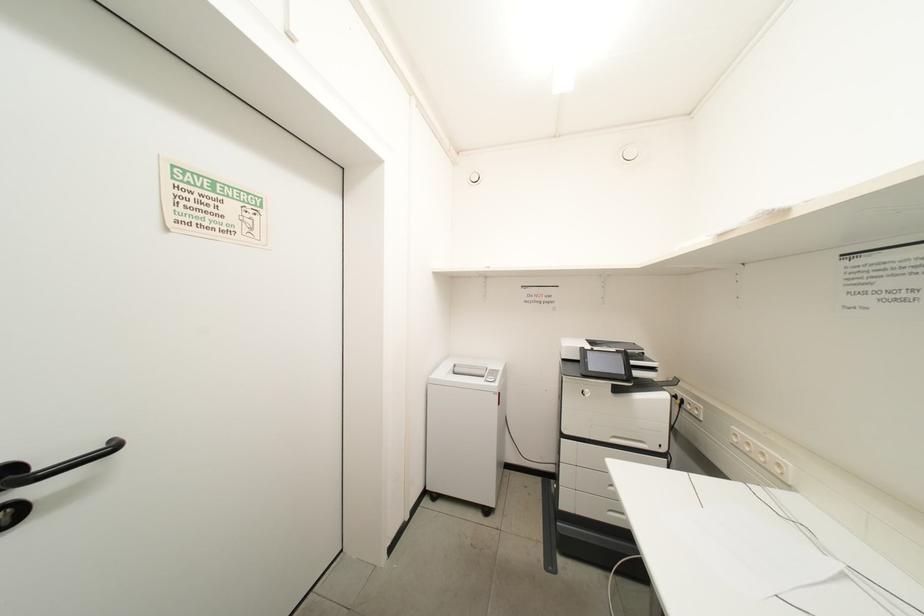
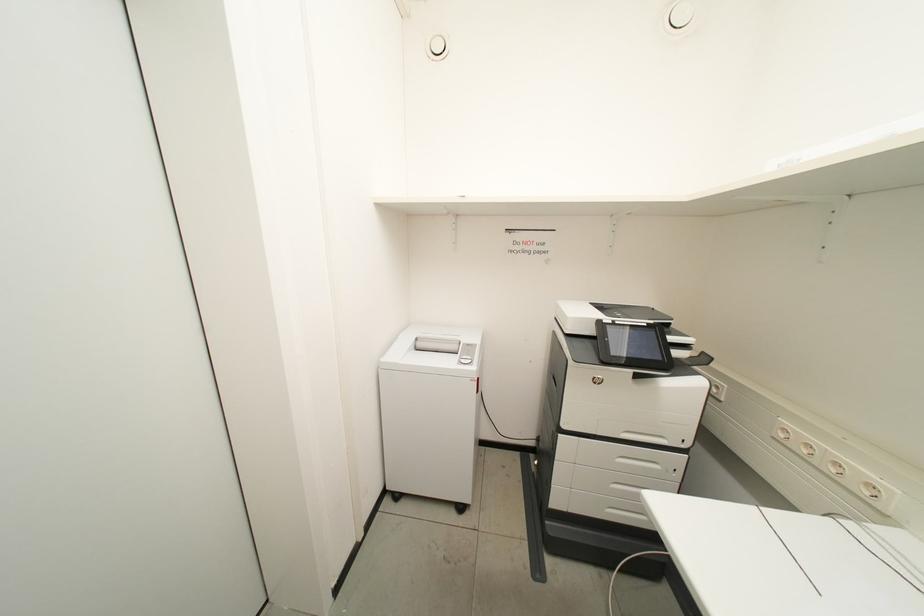
Question: In a continuous first-person perspective shot, in which direction is the camera moving?

Choices:
 (A) Left
 (B) Right
 (C) Forward
 (D) Backward

Answer: (C)